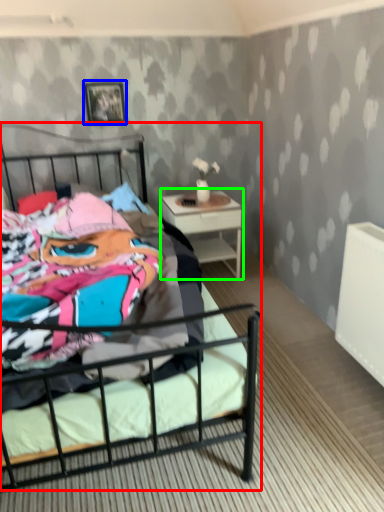
Question: Which object is the closest to the bed (highlighted by a red box)? Choose among these: picture frame (highlighted by a blue box) or nightstand (highlighted by a green box).

Choices:
 (A) picture frame
 (B) nightstand

Answer: (B)